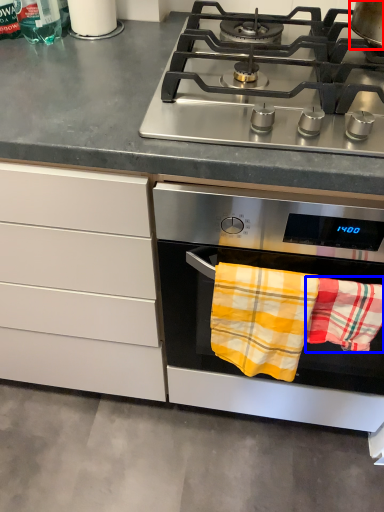
Question: Which point is further to the camera, kitchen appliance (highlighted by a red box) or beach towel (highlighted by a blue box)?

Choices:
 (A) kitchen appliance
 (B) beach towel

Answer: (B)